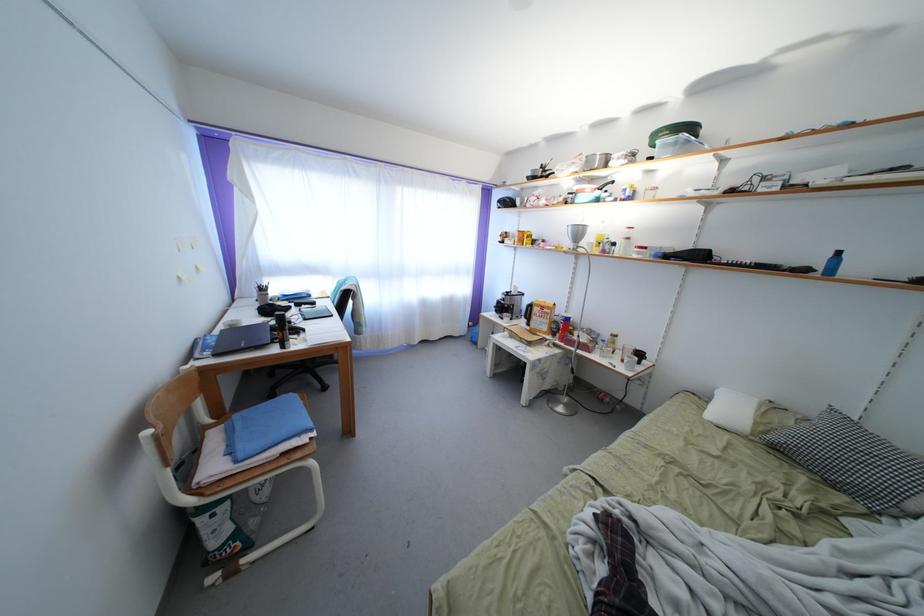
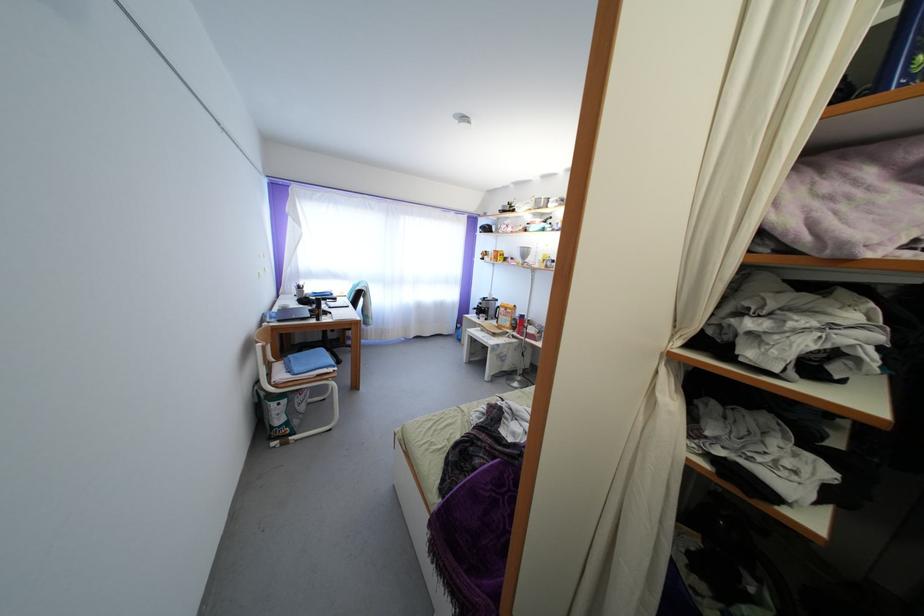
Question: How did the camera likely rotate?

Choices:
 (A) Left
 (B) Right
 (C) Up
 (D) Down

Answer: (C)